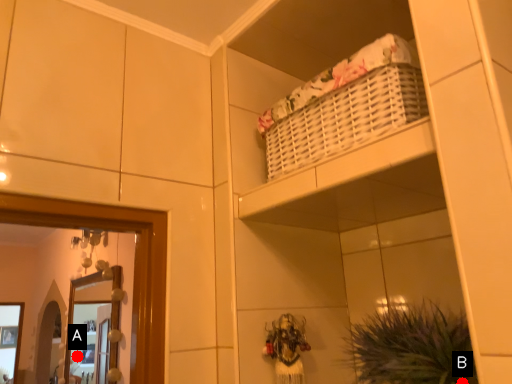
Question: Two points are circled on the image, labeled by A and B beside each circle. Among these points, which one is nearest to the camera?

Choices:
 (A) A is closer
 (B) B is closer

Answer: (B)